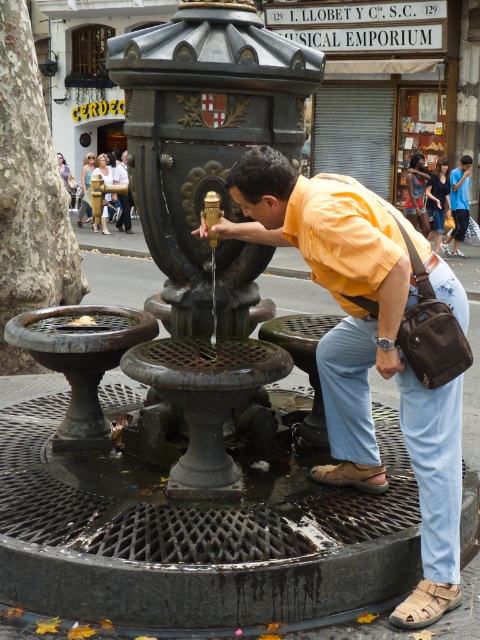
Based on the photo, between tan leather sandal at lower right and brown leather sandal at lower center, which one is positioned lower?

tan leather sandal at lower right is below.

Who is higher up, tan leather sandal at lower right or brown leather sandal at lower center?

brown leather sandal at lower center is higher up.

This screenshot has height=640, width=480. I want to click on tan leather sandal at lower right, so click(425, 604).

Where is `tan leather sandal at lower right`? This screenshot has height=640, width=480. tan leather sandal at lower right is located at coordinates (425, 604).

Is matte yellow shirt at center taller than brown leather sandal at lower center?

Yes, matte yellow shirt at center is taller than brown leather sandal at lower center.

What do you see at coordinates (365, 324) in the screenshot? The height and width of the screenshot is (640, 480). I see `matte yellow shirt at center` at bounding box center [365, 324].

What do you see at coordinates (365, 324) in the screenshot? The width and height of the screenshot is (480, 640). I see `matte yellow shirt at center` at bounding box center [365, 324].

Find the location of a particular element. The width and height of the screenshot is (480, 640). matte yellow shirt at center is located at coordinates (365, 324).

Is matte yellow shirt at center thinner than tan leather sandal at lower right?

No, matte yellow shirt at center is not thinner than tan leather sandal at lower right.

Can you confirm if matte yellow shirt at center is positioned to the left of tan leather sandal at lower right?

Indeed, matte yellow shirt at center is positioned on the left side of tan leather sandal at lower right.

Identify the location of matte yellow shirt at center. Image resolution: width=480 pixels, height=640 pixels. (365, 324).